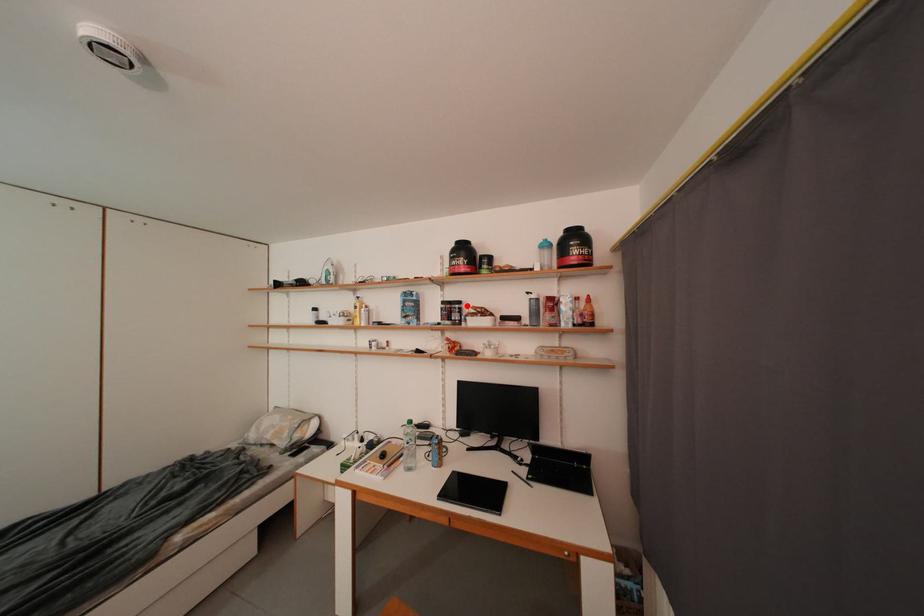
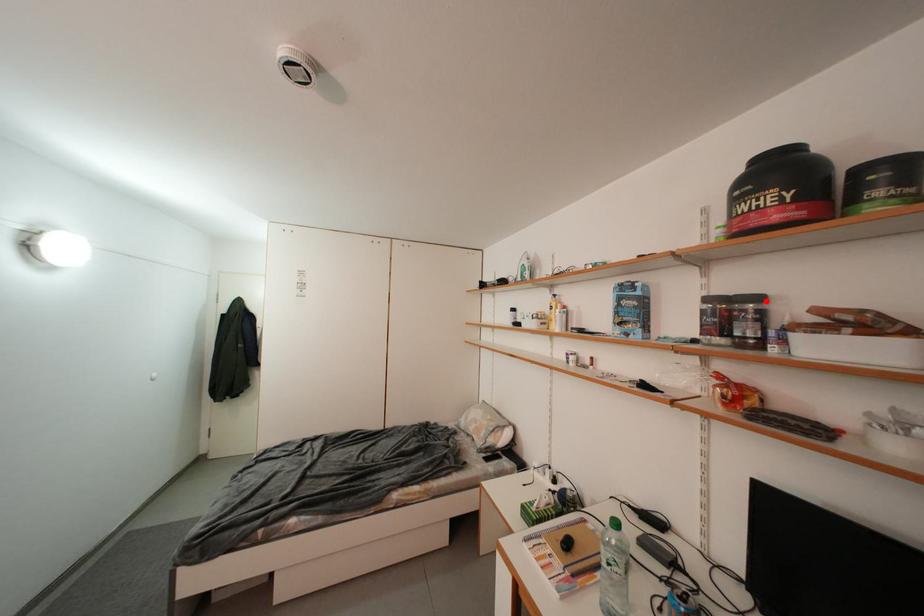
I am providing you with two images of the same scene from different viewpoints. A red point is marked on the first image and another point is marked on the second image. Is the red point in image1 aligned with the point shown in image2?

Yes